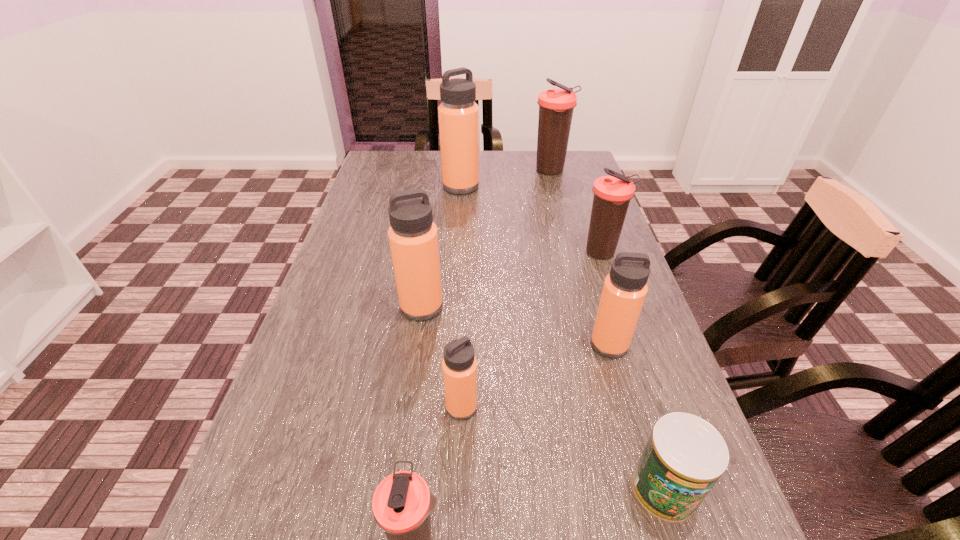
The height and width of the screenshot is (540, 960). What are the coordinates of `object that can be found as the fourth closest to the biggest brown thermos bottle` in the screenshot? It's located at (624, 291).

Identify the location of the seventh closest object to the tallest thermos bottle. The height and width of the screenshot is (540, 960). (402, 503).

Locate an element on the screen. thermos bottle object that ranks as the sixth closest to the second nearest brown thermos bottle is located at coordinates (402, 503).

I want to click on thermos bottle that is the second closest to the fifth farthest thermos bottle, so click(x=459, y=366).

Point out which orange thermos bottle is positioned as the second nearest to the biggest orange thermos bottle. Please provide its 2D coordinates. Your answer should be formatted as a tuple, i.e. [(x, y)], where the tuple contains the x and y coordinates of a point satisfying the conditions above.

[(624, 291)]

You are a GUI agent. You are given a task and a screenshot of the screen. Output one action in this format:
    pyautogui.click(x=<x>, y=<y>)
    Task: Click on the orange thermos bottle that is the nearest to the sixth farthest object
    
    Given the screenshot: What is the action you would take?
    pyautogui.click(x=413, y=237)

The height and width of the screenshot is (540, 960). Find the location of `the closest brown thermos bottle relative to the third farthest object`. the closest brown thermos bottle relative to the third farthest object is located at coordinates (556, 106).

This screenshot has height=540, width=960. I want to click on brown thermos bottle that stands as the second closest to the third farthest thermos bottle, so click(402, 503).

This screenshot has width=960, height=540. What are the coordinates of `free location that satisfies the following two spatial constraints: 1. on the back side of the fifth nearest thermos bottle; 2. on the left side of the rightmost orange thermos bottle` in the screenshot? It's located at (583, 253).

Find the location of a particular element. Image resolution: width=960 pixels, height=540 pixels. vacant area that satisfies the following two spatial constraints: 1. on the front side of the can; 2. on the right side of the biggest brown thermos bottle is located at coordinates (632, 488).